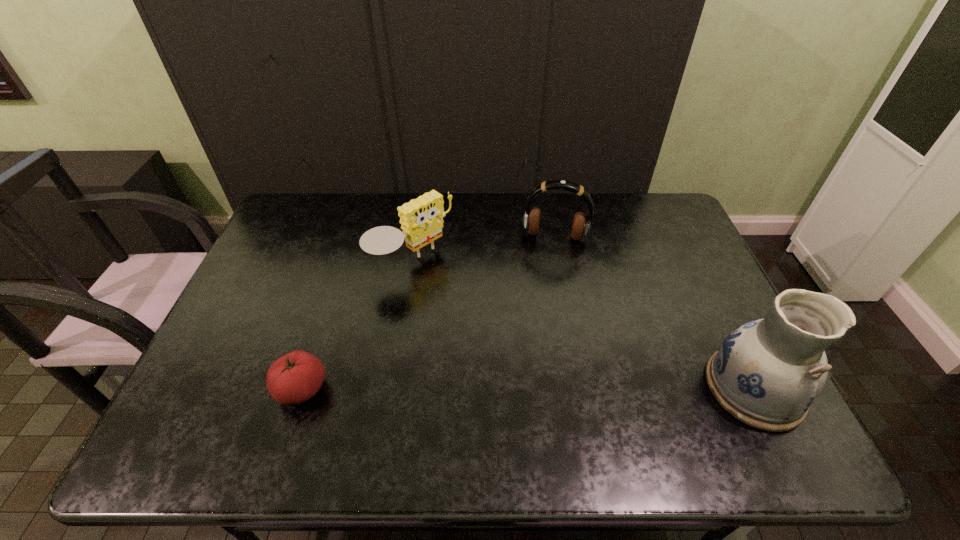
At what (x,y) coordinates should I click in order to perform the action: click on the shortest object. Please return your answer as a coordinate pair (x, y). Looking at the image, I should click on (294, 378).

I want to click on the leftmost object, so click(x=294, y=378).

Where is `pottery`? pottery is located at coordinates (767, 373).

Locate an element on the screen. The image size is (960, 540). the tallest object is located at coordinates (767, 373).

In order to click on the third object from left to right in this screenshot , I will do `click(581, 224)`.

You are a GUI agent. You are given a task and a screenshot of the screen. Output one action in this format:
    pyautogui.click(x=<x>, y=<y>)
    Task: Click on the sponge
    This screenshot has width=960, height=540.
    Given the screenshot: What is the action you would take?
    pyautogui.click(x=421, y=219)

What are the coordinates of `vacant space situated on the left of the shortest object` in the screenshot? It's located at (208, 389).

Locate an element on the screen. The height and width of the screenshot is (540, 960). free spot located on the left of the tallest object is located at coordinates (640, 388).

Locate an element on the screen. The height and width of the screenshot is (540, 960). free space located 0.200m on the ear cup of the second object from right to left is located at coordinates (544, 290).

Find the location of a particular element. This screenshot has height=540, width=960. vacant position located on the ear cup of the second object from right to left is located at coordinates point(546,269).